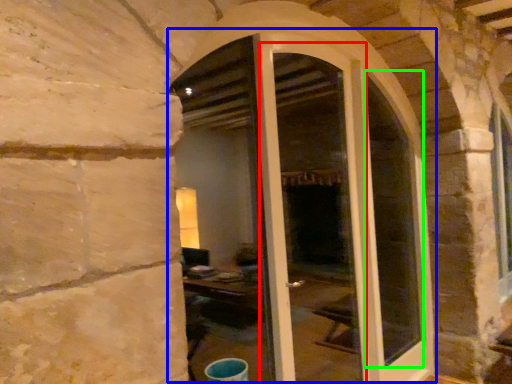
Question: Which is nearer to the screen door (highlighted by a red box)? door (highlighted by a blue box) or glass window (highlighted by a green box).

Choices:
 (A) door
 (B) glass window

Answer: (B)